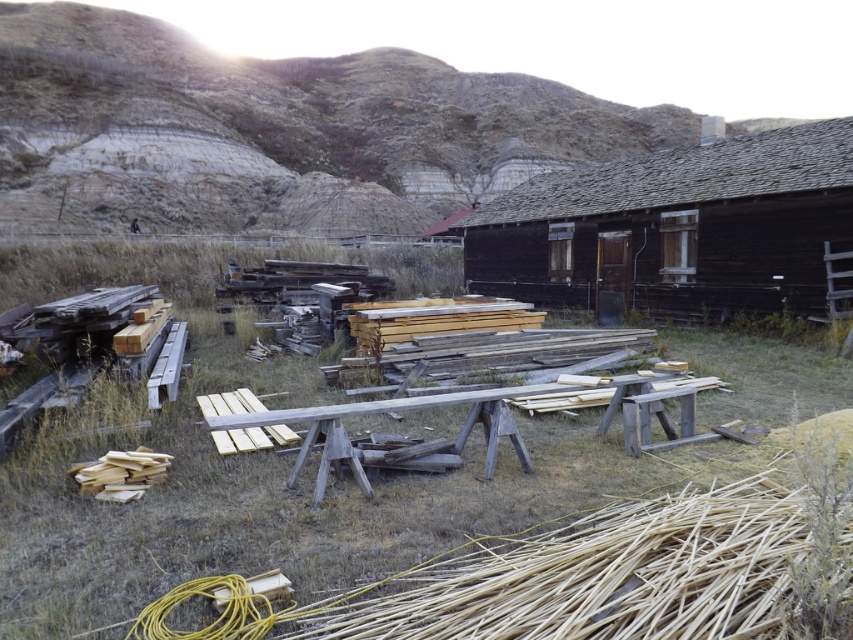
Is the position of green grass at center less distant than that of wooden picnic table at center?

Yes, green grass at center is closer to the viewer.

How distant is green grass at center from wooden picnic table at center?

A distance of 4.75 meters exists between green grass at center and wooden picnic table at center.

This screenshot has height=640, width=853. What do you see at coordinates (252, 460) in the screenshot? I see `green grass at center` at bounding box center [252, 460].

This screenshot has width=853, height=640. Identify the location of green grass at center. (252, 460).

Is dark brown wooden cabin at center to the right of wooden picnic table at center from the viewer's perspective?

Indeed, dark brown wooden cabin at center is positioned on the right side of wooden picnic table at center.

At what (x,y) coordinates should I click in order to perform the action: click on dark brown wooden cabin at center. Please return your answer as a coordinate pair (x, y). This screenshot has height=640, width=853. Looking at the image, I should click on (x=680, y=228).

Consider the image. Who is shorter, green grass at center or dark brown wooden cabin at center?

With less height is green grass at center.

Image resolution: width=853 pixels, height=640 pixels. Describe the element at coordinates (252, 460) in the screenshot. I see `green grass at center` at that location.

You are a GUI agent. You are given a task and a screenshot of the screen. Output one action in this format:
    pyautogui.click(x=<x>, y=<y>)
    Task: Click on the green grass at center
    The height and width of the screenshot is (640, 853).
    Given the screenshot: What is the action you would take?
    pyautogui.click(x=252, y=460)